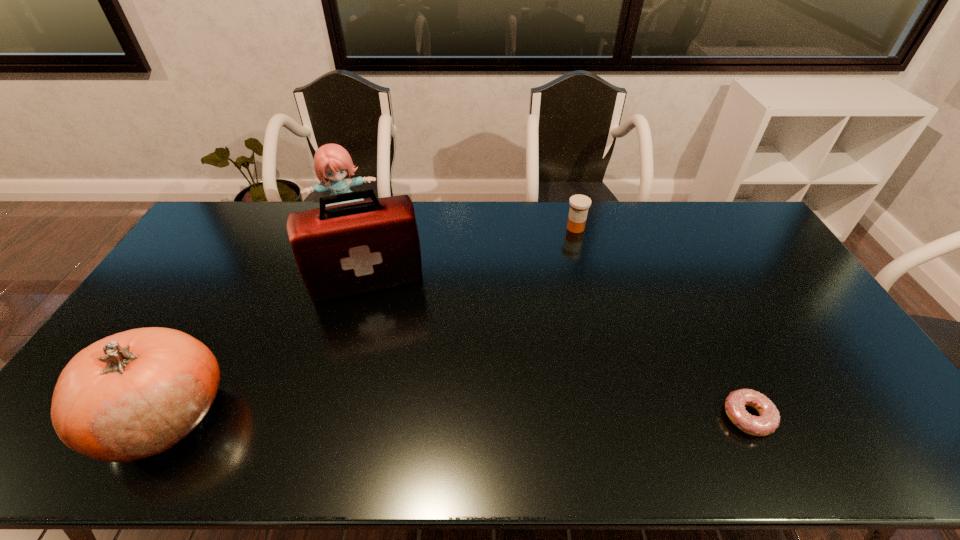
Locate an element on the screen. blank region between the doll and the shortest object is located at coordinates (547, 318).

Where is `empty location between the doughnut and the pumpkin`? The height and width of the screenshot is (540, 960). empty location between the doughnut and the pumpkin is located at coordinates (456, 416).

The height and width of the screenshot is (540, 960). What are the coordinates of `vacant point located between the doll and the pumpkin` in the screenshot? It's located at (255, 317).

Find the location of a particular element. This screenshot has height=540, width=960. free spot between the first aid kit and the fourth object from left to right is located at coordinates (471, 254).

You are a GUI agent. You are given a task and a screenshot of the screen. Output one action in this format:
    pyautogui.click(x=<x>, y=<y>)
    Task: Click on the vacant space that's between the second object from right to left and the doll
    
    Given the screenshot: What is the action you would take?
    pyautogui.click(x=461, y=223)

Find the location of a particular element. The image size is (960, 540). empty location between the pumpkin and the doll is located at coordinates (255, 317).

Locate an element on the screen. This screenshot has width=960, height=540. free space between the medicine and the pumpkin is located at coordinates (370, 322).

Identify the location of free space between the doll and the fourth tallest object. The image size is (960, 540). (461, 223).

The image size is (960, 540). I want to click on the fourth closest object to the doll, so click(x=768, y=421).

Identify which object is the closest to the pumpkin. Please provide its 2D coordinates. Your answer should be formatted as a tuple, i.e. [(x, y)], where the tuple contains the x and y coordinates of a point satisfying the conditions above.

[(342, 250)]